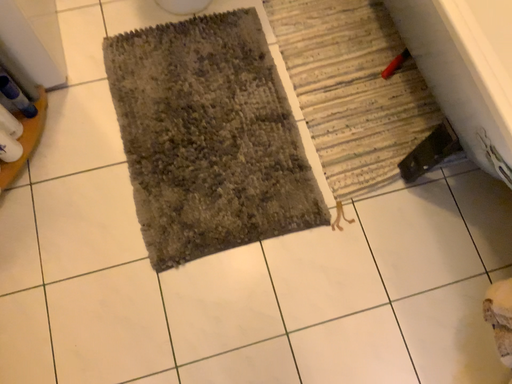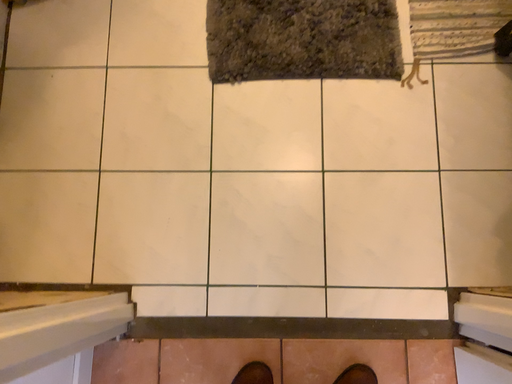
Question: How did the camera likely rotate when shooting the video?

Choices:
 (A) rotated downward
 (B) rotated upward

Answer: (A)